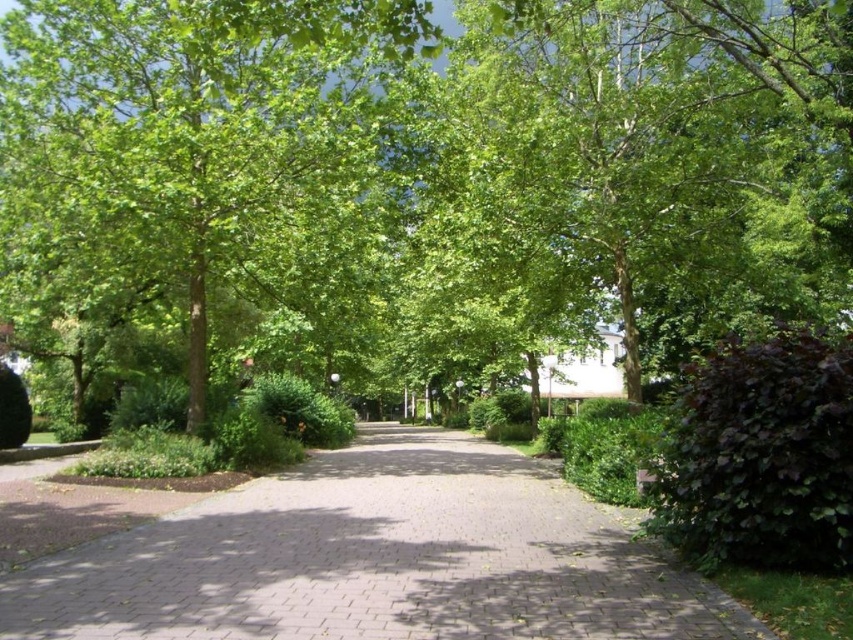
Is green leafy tree at center to the right of green leafy bush at center from the viewer's perspective?

Incorrect, green leafy tree at center is not on the right side of green leafy bush at center.

Which is above, green leafy tree at center or green leafy bush at center?

green leafy tree at center

Image resolution: width=853 pixels, height=640 pixels. What do you see at coordinates (171, 132) in the screenshot? I see `green leafy tree at center` at bounding box center [171, 132].

Image resolution: width=853 pixels, height=640 pixels. What are the coordinates of `green leafy tree at center` in the screenshot? It's located at (171, 132).

Measure the distance from green leafy tree at center to dark purple leafy bush at right.

green leafy tree at center is 8.26 meters from dark purple leafy bush at right.

Is point (297, 72) less distant than point (675, 483)?

No, (297, 72) is further to viewer.

At what (x,y) coordinates should I click in order to perform the action: click on green leafy tree at center. Please return your answer as a coordinate pair (x, y). Looking at the image, I should click on (171, 132).

Does point (204, 522) come closer to viewer compared to point (720, 563)?

That is False.

Where is `paved brick road at center`? Image resolution: width=853 pixels, height=640 pixels. paved brick road at center is located at coordinates (376, 560).

Is point (44, 604) positioned after point (779, 472)?

No, it is not.

Identify the location of paved brick road at center. tap(376, 560).